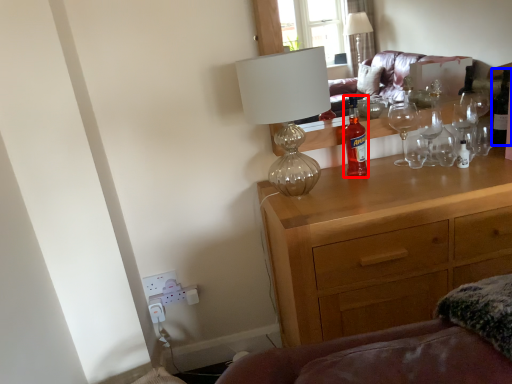
Question: Which point is further to the camera, bottle (highlighted by a red box) or wine bottle (highlighted by a blue box)?

Choices:
 (A) bottle
 (B) wine bottle

Answer: (B)